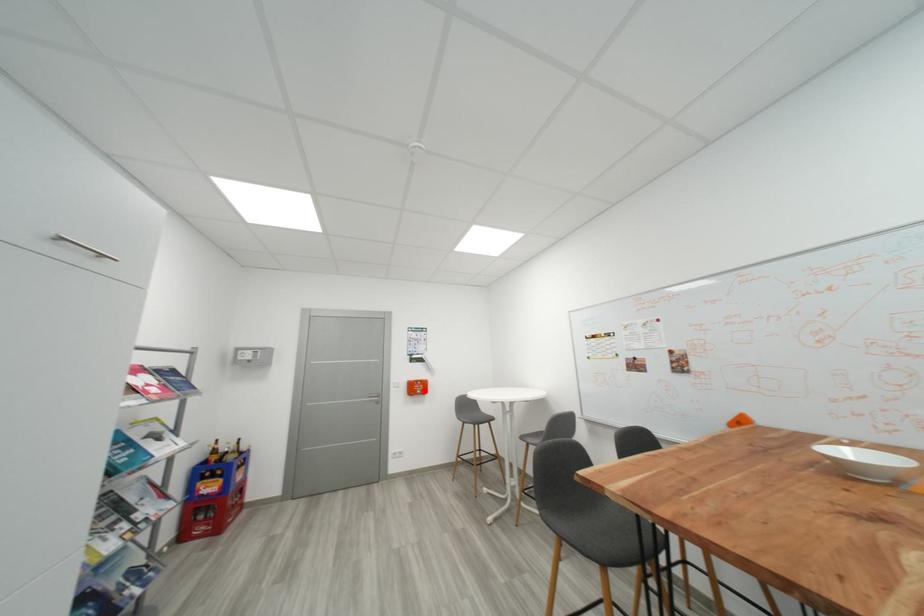
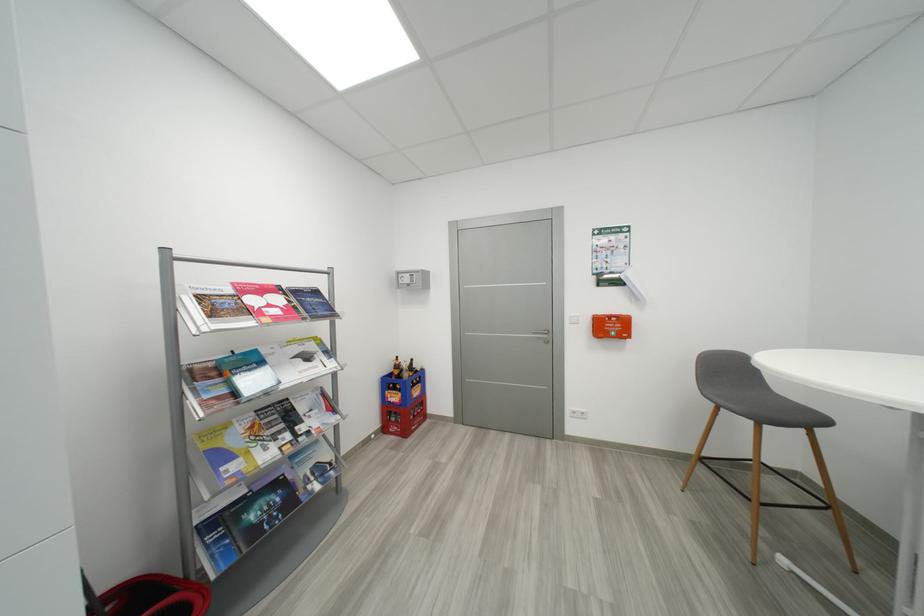
Question: I am providing you with two images of the same scene from different viewpoints. A red point is marked on the first image. Is the red point's position out of view in image 2?

Choices:
 (A) Yes
 (B) No

Answer: (B)